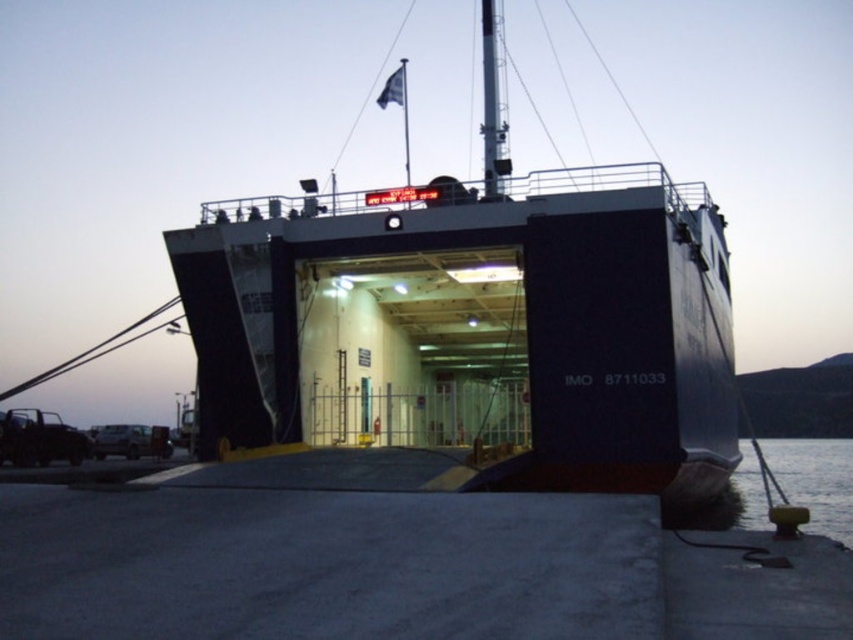
Question: Does dark blue matte ship at center come in front of dark blue water at lower right?

Choices:
 (A) no
 (B) yes

Answer: (A)

Question: Can you confirm if dark blue matte ship at center is bigger than dark blue water at lower right?

Choices:
 (A) yes
 (B) no

Answer: (B)

Question: Does dark blue matte ship at center have a greater width compared to dark blue water at lower right?

Choices:
 (A) no
 (B) yes

Answer: (A)

Question: Which of the following is the farthest from the observer?

Choices:
 (A) dark blue matte ship at center
 (B) dark blue water at lower right

Answer: (A)

Question: Which of the following is the farthest from the observer?

Choices:
 (A) dark blue matte ship at center
 (B) dark blue water at lower right

Answer: (A)

Question: Which point is closer to the camera?

Choices:
 (A) dark blue matte ship at center
 (B) dark blue water at lower right

Answer: (B)